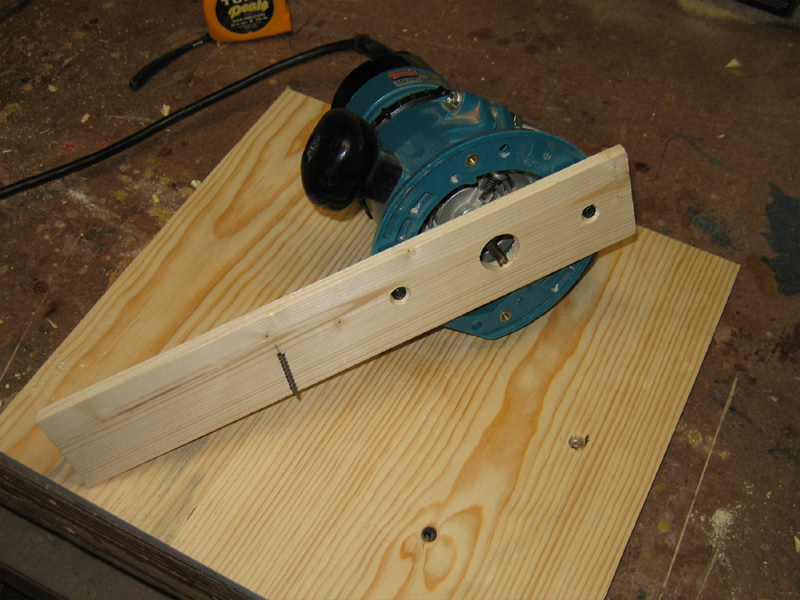
This screenshot has height=600, width=800. Find the location of `wood plank`. wood plank is located at coordinates (348, 326).